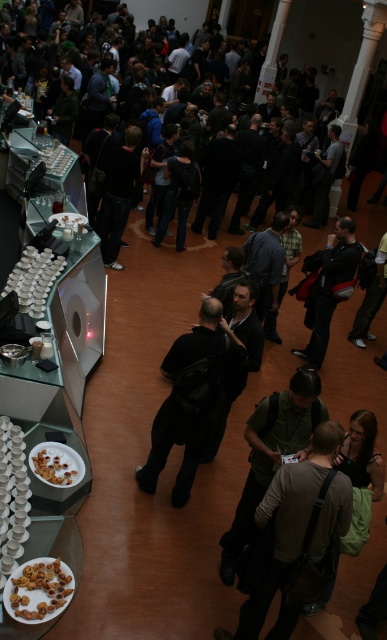
Question: Considering the real-world distances, which object is closest to the golden crumbly pastry at lower left?

Choices:
 (A) black matte backpack at center
 (B) dark gray backpack at center

Answer: (A)

Question: Is black matte backpack at center above brown matte nuts at lower left?

Choices:
 (A) no
 (B) yes

Answer: (B)

Question: Can you confirm if black matte backpack at center is wider than brown matte nuts at lower left?

Choices:
 (A) yes
 (B) no

Answer: (A)

Question: Which is nearer to the golden crumbly pastry at lower left?

Choices:
 (A) dark gray backpack at center
 (B) black matte backpack at center
 (C) brown matte nuts at lower left

Answer: (C)

Question: Which object appears closest to the camera in this image?

Choices:
 (A) brown matte nuts at lower left
 (B) golden crumbly pastry at lower left
 (C) dark gray backpack at center
 (D) black matte backpack at center

Answer: (A)

Question: Is brown matte nuts at lower left positioned in front of golden crumbly pastry at lower left?

Choices:
 (A) no
 (B) yes

Answer: (B)